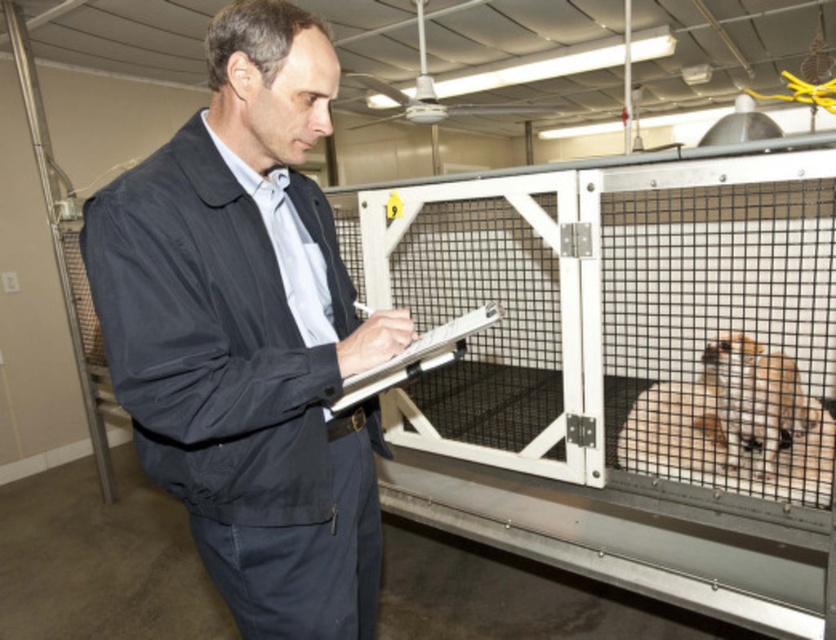
You are a researcher in the lab who needs to reach for the white plastic clipboard at center while holding the dark blue fabric jacket at center. Can you comfortably reach both items at the same time?

The dark blue fabric jacket at center and white plastic clipboard at center are 23.77 centimeters apart from each other, so yes, you can comfortably reach both items at the same time since the distance between them is manageable for a researcher to handle both.

You are an observer in the laboratory. You see the light brown fur at right and the white plastic clipboard at center. Which object is located lower in the image?

The light brown fur at right is located below the white plastic clipboard at center, so it is lower in the image.

The man in the scene is holding a white plastic clipboard at center and wearing a dark blue fabric jacket at center. Which object is wider?

The dark blue fabric jacket at center is wider than the white plastic clipboard at center.